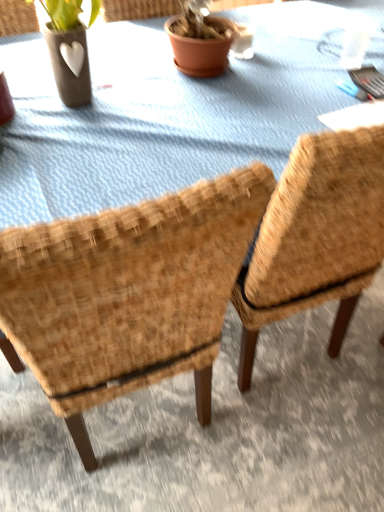
Where is `woven wood chair at center`? Image resolution: width=384 pixels, height=512 pixels. woven wood chair at center is located at coordinates point(129,293).

What do you see at coordinates (129, 293) in the screenshot?
I see `woven wood chair at center` at bounding box center [129, 293].

The image size is (384, 512). I want to click on woven wood chair at center, so click(x=129, y=293).